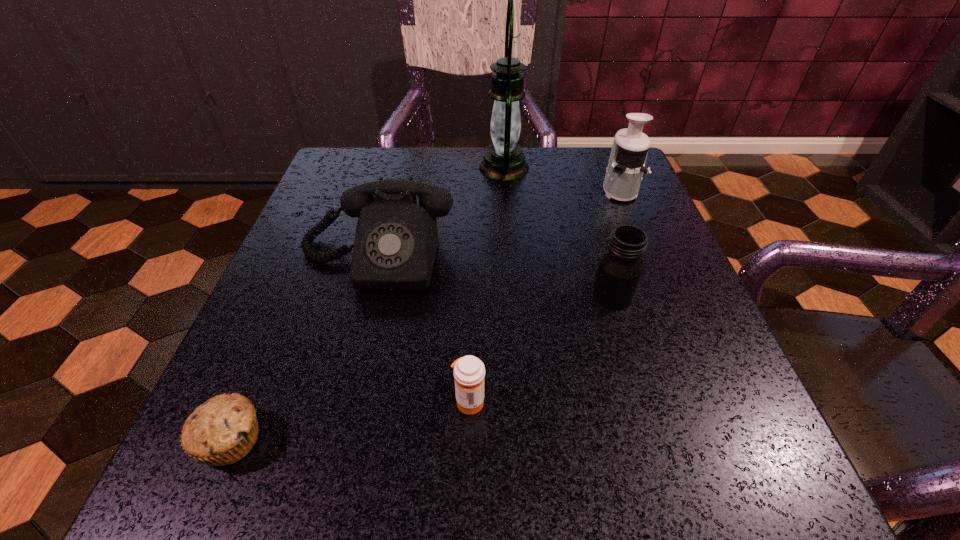
Where is `empty space that is in between the rightmost object and the fifth tallest object`? empty space that is in between the rightmost object and the fifth tallest object is located at coordinates (544, 296).

Where is `empty location between the second shortest object and the rightmost object`? empty location between the second shortest object and the rightmost object is located at coordinates (544, 296).

Find the location of a particular element. This screenshot has width=960, height=540. vacant point located between the juicer and the fifth tallest object is located at coordinates (544, 296).

Identify the location of empty location between the rightmost object and the medicine. The image size is (960, 540). (544, 296).

Where is `empty space that is in between the medicine and the shortest object`? The image size is (960, 540). empty space that is in between the medicine and the shortest object is located at coordinates (349, 421).

The width and height of the screenshot is (960, 540). Find the location of `vacant space that is in between the medicine and the second tallest object`. vacant space that is in between the medicine and the second tallest object is located at coordinates (544, 296).

You are a GUI agent. You are given a task and a screenshot of the screen. Output one action in this format:
    pyautogui.click(x=<x>, y=<y>)
    Task: Click on the free spot between the medicine and the shortest object
    This screenshot has height=540, width=960.
    Given the screenshot: What is the action you would take?
    pyautogui.click(x=349, y=421)

Find the location of a particular element. vacant area that lies between the jar and the telephone is located at coordinates (494, 276).

Identify the location of vacant area that lies between the muffin and the lantern. (368, 304).

The height and width of the screenshot is (540, 960). Identify the location of free space between the second object from right to left and the telephone. (494, 276).